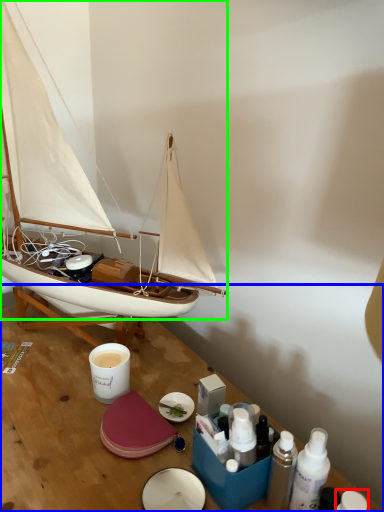
Question: Considering the real-world distances, which object is closest to toiletry (highlighted by a red box)? table (highlighted by a blue box) or boat (highlighted by a green box).

Choices:
 (A) table
 (B) boat

Answer: (A)